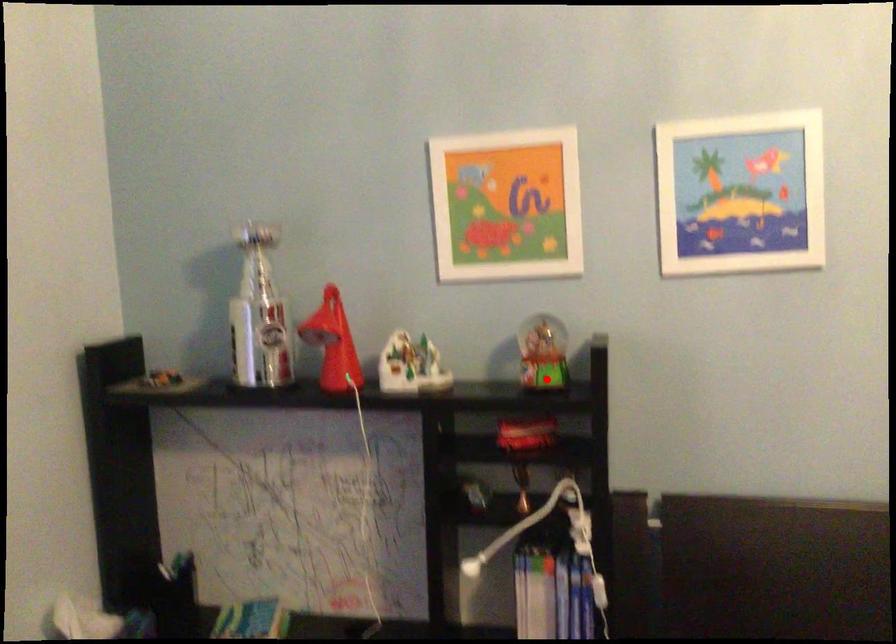
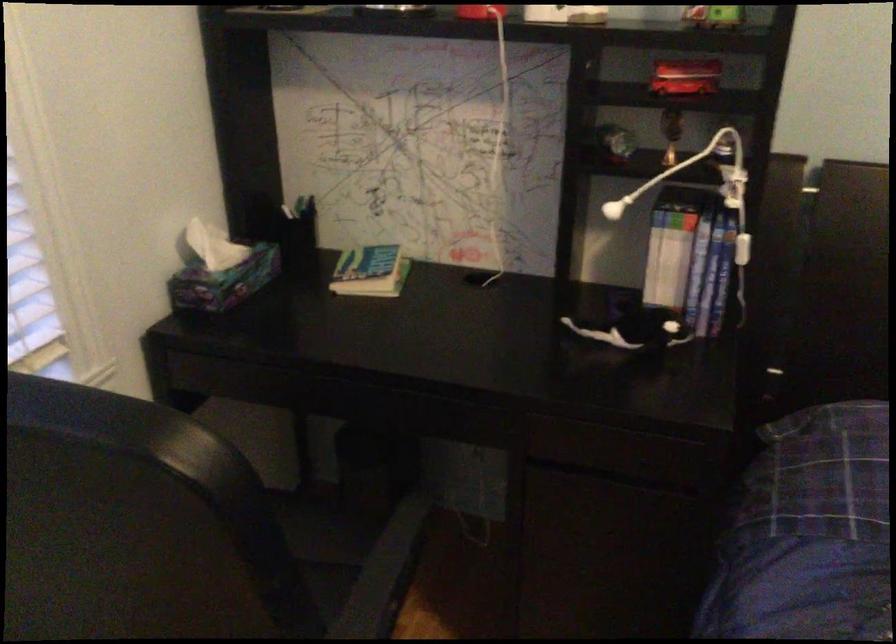
Find the pixel in the second image that matches the highlighted location in the first image.

(713, 17)